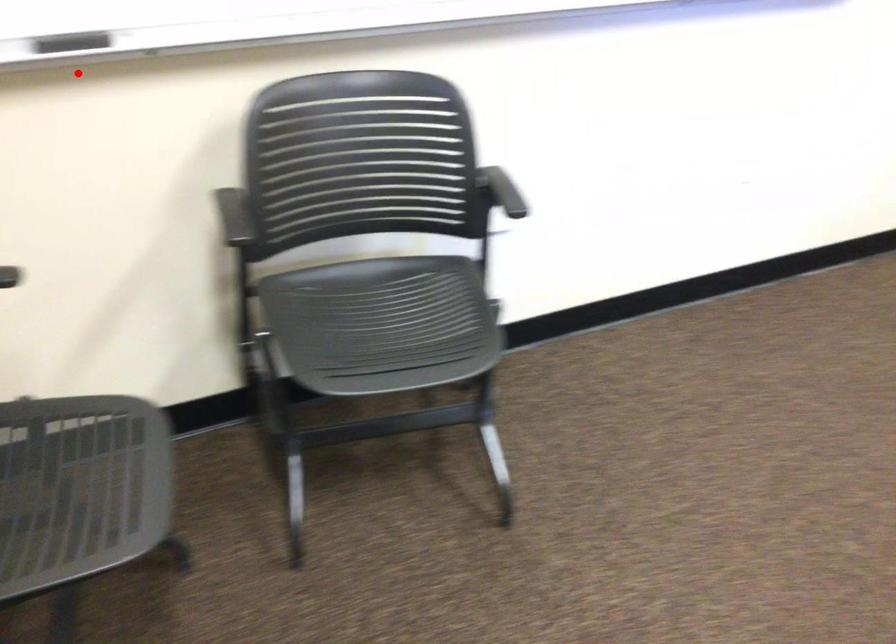
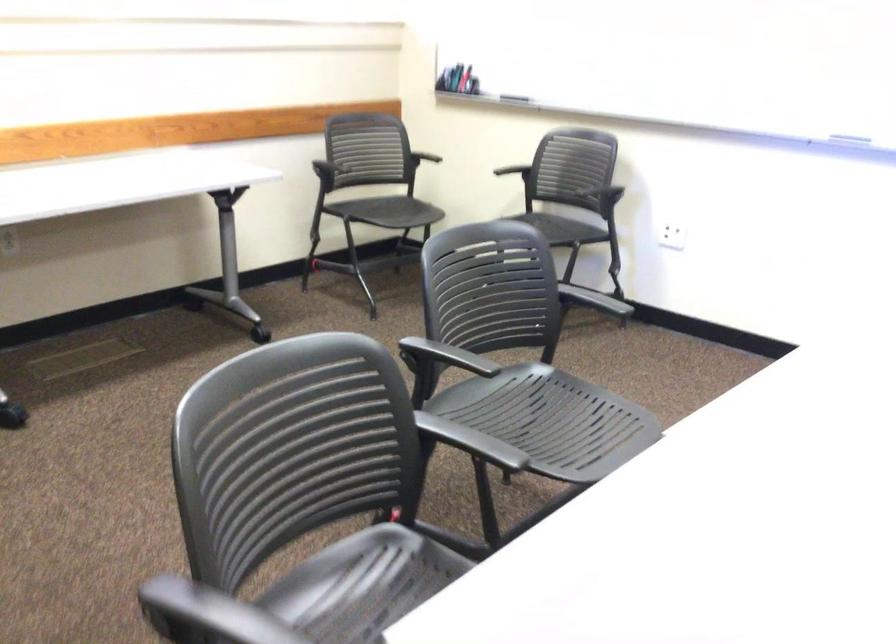
Question: I am providing you with two images of the same scene from different viewpoints. Image1 has a red point marked. In image2, the corresponding 3D location appears at what relative position? Reply with the corresponding letter.

Choices:
 (A) Closer
 (B) Farther

Answer: (B)